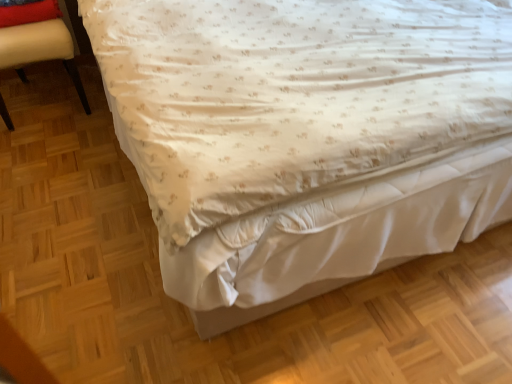
You are a GUI agent. You are given a task and a screenshot of the screen. Output one action in this format:
    pyautogui.click(x=<x>, y=<y>)
    Task: Click on the vacant space in front of beige leather chair at left
    The image size is (512, 384).
    Given the screenshot: What is the action you would take?
    pyautogui.click(x=50, y=148)